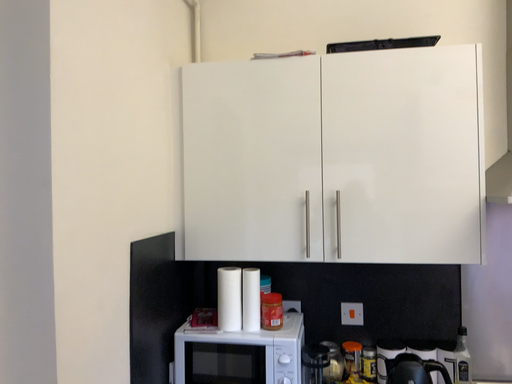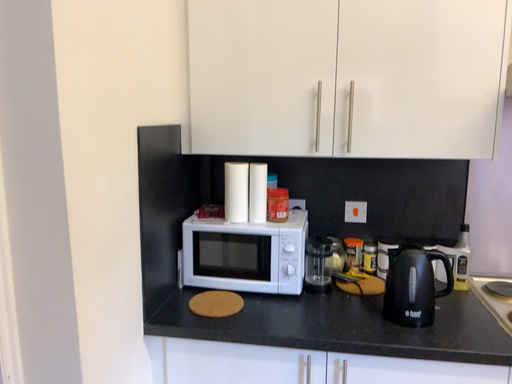
Question: How did the camera likely rotate when shooting the video?

Choices:
 (A) rotated upward
 (B) rotated downward

Answer: (B)